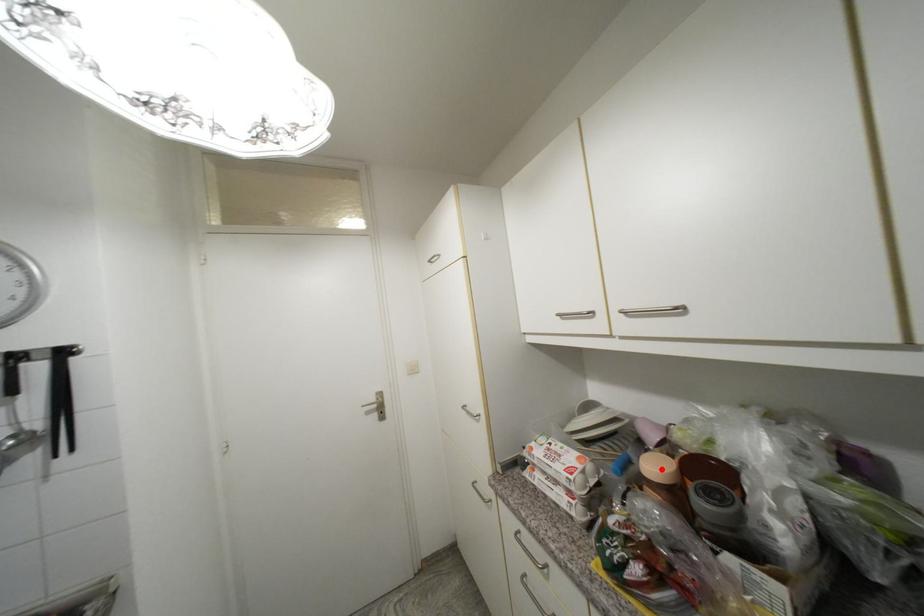
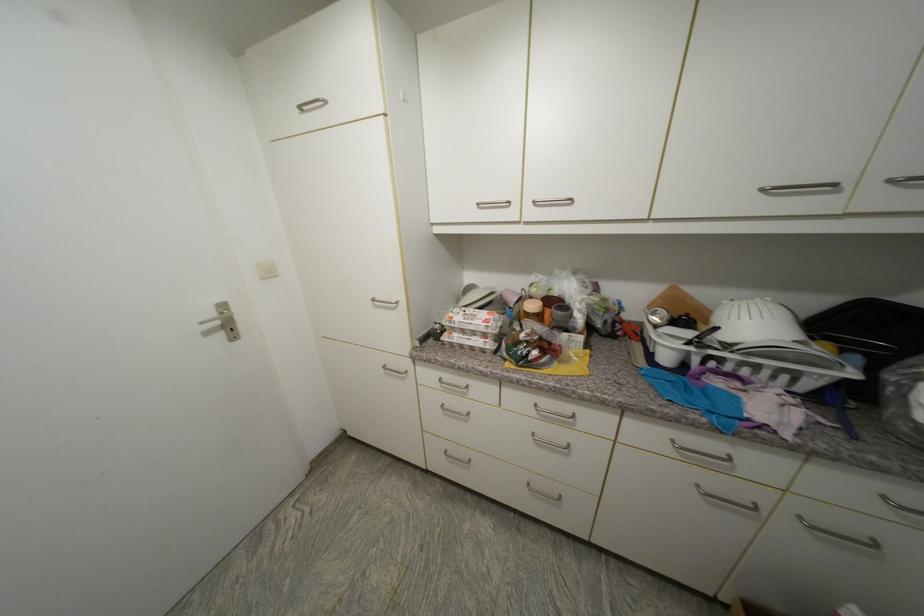
In the second image, find the point that corresponds to the highlighted location in the first image.

(538, 307)